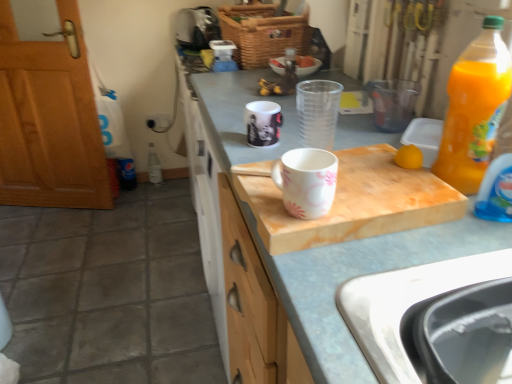
Question: Should I look upward or downward to see woven brown basket at upper center?

Choices:
 (A) down
 (B) up

Answer: (B)

Question: From the image's perspective, is black plastic sink at lower right beneath wooden door at left?

Choices:
 (A) yes
 (B) no

Answer: (A)

Question: Considering the relative positions of black plastic sink at lower right and wooden door at left in the image provided, is black plastic sink at lower right to the left of wooden door at left from the viewer's perspective?

Choices:
 (A) yes
 (B) no

Answer: (B)

Question: Is black plastic sink at lower right oriented away from wooden door at left?

Choices:
 (A) no
 (B) yes

Answer: (A)

Question: Is black plastic sink at lower right directly adjacent to wooden door at left?

Choices:
 (A) no
 (B) yes

Answer: (A)

Question: Considering the relative positions of black plastic sink at lower right and wooden door at left in the image provided, is black plastic sink at lower right in front of wooden door at left?

Choices:
 (A) yes
 (B) no

Answer: (A)

Question: Does black plastic sink at lower right come behind wooden door at left?

Choices:
 (A) yes
 (B) no

Answer: (B)

Question: Is white marble cutting board at center not within white glossy mug at center, the first coffee cup positioned from the top?

Choices:
 (A) yes
 (B) no

Answer: (A)

Question: Can you confirm if white marble cutting board at center is thinner than white glossy mug at center, which is the 2th coffee cup from bottom to top?

Choices:
 (A) no
 (B) yes

Answer: (A)

Question: Is white marble cutting board at center closer to the viewer compared to white glossy mug at center, which ranks as the first coffee cup in back-to-front order?

Choices:
 (A) yes
 (B) no

Answer: (B)

Question: Can you confirm if white marble cutting board at center is positioned to the right of white glossy mug at center, which is the 2th coffee cup from bottom to top?

Choices:
 (A) yes
 (B) no

Answer: (A)

Question: Considering the relative sizes of white marble cutting board at center and white glossy mug at center, the first coffee cup positioned from the top, in the image provided, is white marble cutting board at center wider than white glossy mug at center, the first coffee cup positioned from the top,?

Choices:
 (A) no
 (B) yes

Answer: (B)

Question: From the image's perspective, does white marble cutting board at center appear lower than white glossy mug at center, the second coffee cup positioned from the front?

Choices:
 (A) yes
 (B) no

Answer: (A)

Question: From the image's perspective, is black plastic sink at lower right beneath white marble cutting board at center?

Choices:
 (A) yes
 (B) no

Answer: (A)